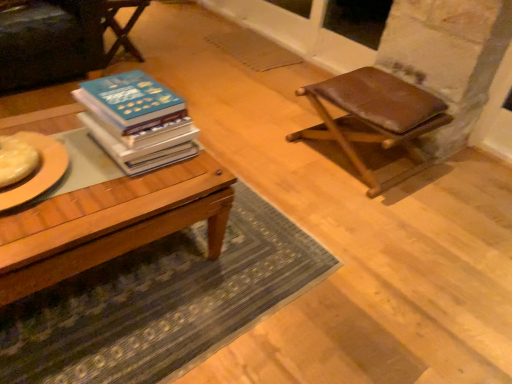
At what (x,y) coordinates should I click in order to perform the action: click on vacant region under green textured rug at lower center (from a real-world perspective). Please return your answer as a coordinate pair (x, y). Looking at the image, I should click on (165, 292).